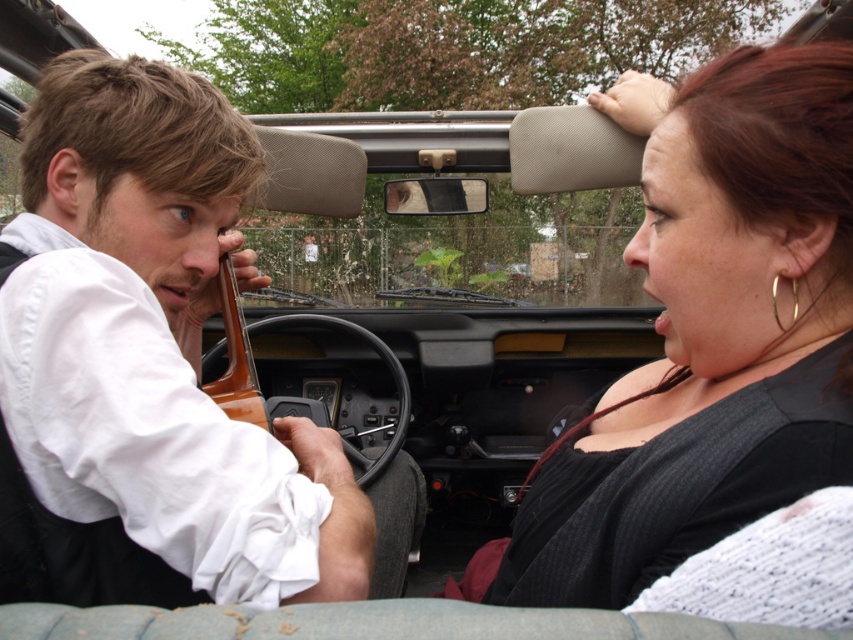
Question: Is brown wood violin at left to the right of gold metallic hoop earring at right ear from the viewer's perspective?

Choices:
 (A) yes
 (B) no

Answer: (B)

Question: Can you confirm if wooden violin at left is positioned above brown wood violin at left?

Choices:
 (A) no
 (B) yes

Answer: (B)

Question: Which point appears farthest from the camera in this image?

Choices:
 (A) (228, 406)
 (B) (798, 291)
 (C) (793, 237)
 (D) (401, 518)

Answer: (D)

Question: Among these points, which one is nearest to the camera?

Choices:
 (A) (795, 321)
 (B) (225, 371)
 (C) (704, 115)
 (D) (61, 257)

Answer: (C)

Question: Can you confirm if brown wood violin at left is positioned to the left of gold metallic hoop earring at right ear?

Choices:
 (A) yes
 (B) no

Answer: (A)

Question: Considering the real-world distances, which object is farthest from the gold metallic hoop earring at right ear?

Choices:
 (A) wooden violin at left
 (B) brown wood violin at left

Answer: (B)